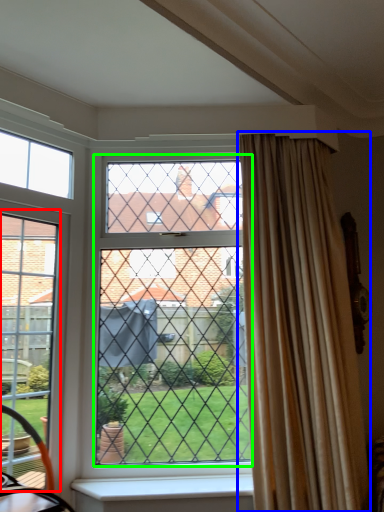
Question: Estimate the real-world distances between objects in this image. Which object is closer to screen door (highlighted by a red box), curtain (highlighted by a blue box) or glass window (highlighted by a green box)?

Choices:
 (A) curtain
 (B) glass window

Answer: (B)